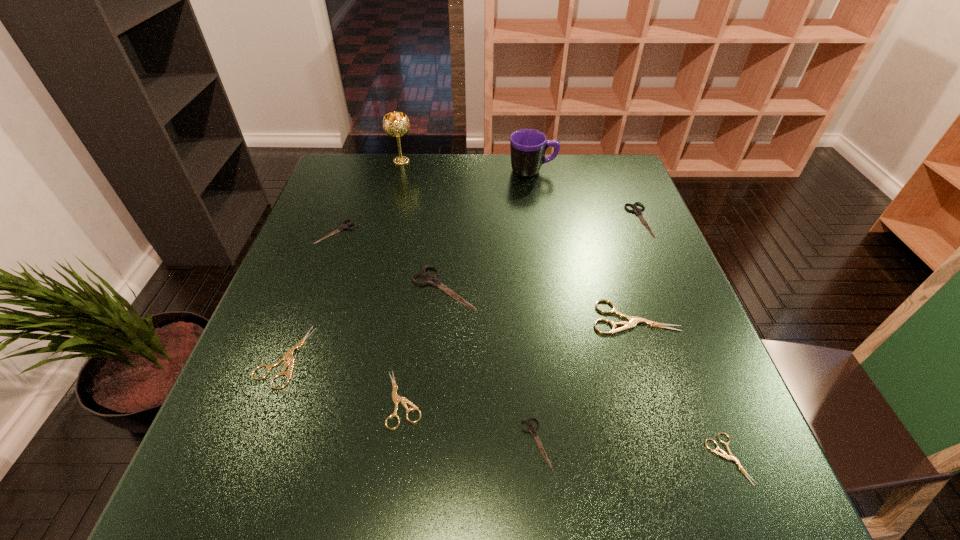
Identify the location of vacant space at the right edge of the desktop. (679, 370).

At what (x,y) coordinates should I click in order to perform the action: click on vacant area at the far left corner. Please return your answer as a coordinate pair (x, y). Looking at the image, I should click on (347, 171).

This screenshot has height=540, width=960. In the image, there is a desktop. What are the coordinates of `free region at the near left corner` in the screenshot? It's located at (183, 516).

The image size is (960, 540). In order to click on free space that is in between the mug and the fifth shears from left to right in this screenshot , I will do point(534,306).

Find the location of a particular element. This screenshot has width=960, height=540. vacant space in between the smallest beige shears and the third smallest beige shears is located at coordinates (506, 408).

At what (x,y) coordinates should I click in order to perform the action: click on vacant region between the biggest beige shears and the third biggest black shears. Please return your answer as a coordinate pair (x, y). Looking at the image, I should click on (486, 275).

I want to click on vacant area that lies between the third biggest black shears and the mug, so click(435, 201).

The image size is (960, 540). Identify the location of free point between the third smallest black shears and the shortest shears. (684, 340).

Where is `free point between the tallest object and the mug`? The width and height of the screenshot is (960, 540). free point between the tallest object and the mug is located at coordinates (467, 166).

This screenshot has width=960, height=540. Identify the location of empty space between the biggest beige shears and the nearest beige shears. (681, 388).